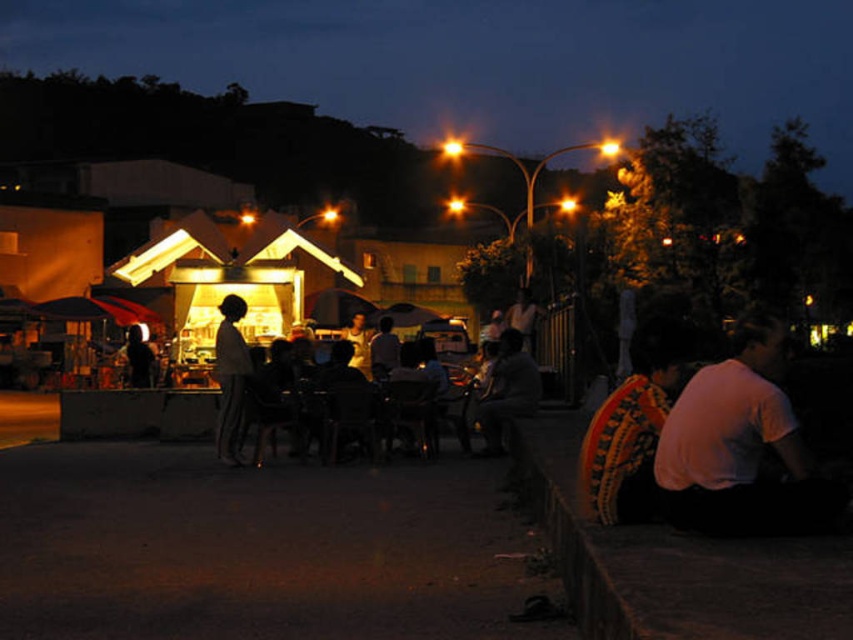
Question: Considering the relative positions of white matte shirt at lower right and silhouette fabric at center in the image provided, where is white matte shirt at lower right located with respect to silhouette fabric at center?

Choices:
 (A) below
 (B) above

Answer: (B)

Question: Which object is closer to the camera taking this photo?

Choices:
 (A) silhouette fabric at center
 (B) white matte shirt at lower right

Answer: (B)

Question: Can you confirm if white matte shirt at lower right is positioned to the left of silhouette fabric at center?

Choices:
 (A) yes
 (B) no

Answer: (B)

Question: Is white matte shirt at lower right thinner than silhouette fabric at center?

Choices:
 (A) no
 (B) yes

Answer: (A)

Question: Which point is closer to the camera taking this photo?

Choices:
 (A) (235, 404)
 (B) (717, 467)

Answer: (B)